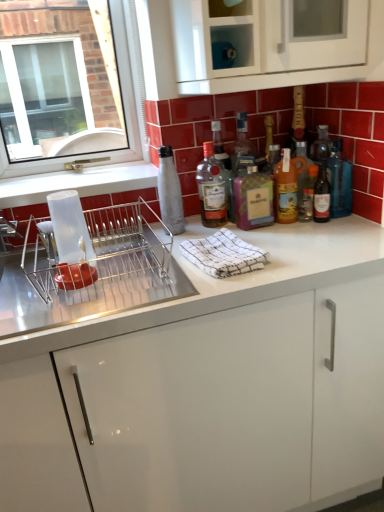
Question: Does translucent glass bottles at center, the 5th bottle from the left, have a lesser height compared to white textured cloth at center?

Choices:
 (A) yes
 (B) no

Answer: (B)

Question: From the image's perspective, is translucent glass bottles at center, the 5th bottle from the left, above white textured cloth at center?

Choices:
 (A) yes
 (B) no

Answer: (A)

Question: From a real-world perspective, is translucent glass bottles at center, the 5th bottle from the left, located beneath white textured cloth at center?

Choices:
 (A) yes
 (B) no

Answer: (B)

Question: From a real-world perspective, is translucent glass bottles at center, the 5th bottle from the left, on white textured cloth at center?

Choices:
 (A) no
 (B) yes

Answer: (B)

Question: Is translucent glass bottles at center, the 2th bottle viewed from the right, with white textured cloth at center?

Choices:
 (A) yes
 (B) no

Answer: (B)

Question: Is translucent glass bottles at center, the 5th bottle from the left, at the left side of white textured cloth at center?

Choices:
 (A) no
 (B) yes

Answer: (A)

Question: From a real-world perspective, does metallic silver dish rack at left stand above matte glass bottle at center, the 2th bottle positioned from the left?

Choices:
 (A) no
 (B) yes

Answer: (A)

Question: Does metallic silver dish rack at left turn towards matte glass bottle at center, the 2th bottle positioned from the left?

Choices:
 (A) no
 (B) yes

Answer: (A)

Question: Is metallic silver dish rack at left wider than matte glass bottle at center, the 2th bottle positioned from the left?

Choices:
 (A) no
 (B) yes

Answer: (B)

Question: Is metallic silver dish rack at left touching matte glass bottle at center, the 2th bottle positioned from the left?

Choices:
 (A) no
 (B) yes

Answer: (A)

Question: Does metallic silver dish rack at left come behind matte glass bottle at center, acting as the 5th bottle starting from the right?

Choices:
 (A) no
 (B) yes

Answer: (A)

Question: From the image's perspective, is metallic silver dish rack at left located beneath matte glass bottle at center, the 2th bottle positioned from the left?

Choices:
 (A) no
 (B) yes

Answer: (B)

Question: Is translucent amber bottle at center, placed as the third bottle when sorted from right to left, closer to camera compared to white glossy cabinet at center, arranged as the first cabinetry when ordered from the bottom?

Choices:
 (A) yes
 (B) no

Answer: (B)